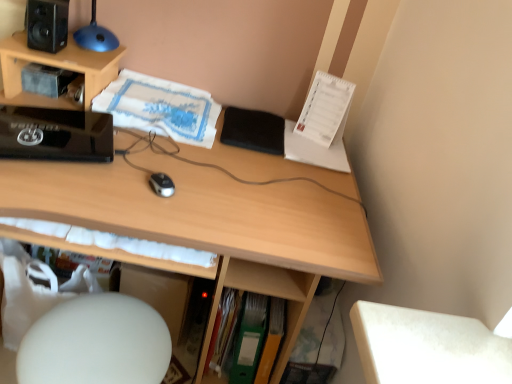
What do you see at coordinates (253, 130) in the screenshot? The height and width of the screenshot is (384, 512). I see `black matte notepad at center` at bounding box center [253, 130].

Find the location of a particular element. The image size is (512, 384). green matte folder at lower center, the second paperback book in the left-to-right sequence is located at coordinates (271, 340).

In order to face green matte folder at lower center, the second paperback book in the left-to-right sequence, should I rotate leftwards or rightwards?

Rotate right and turn 2.032 degrees.

At what (x,y) coordinates should I click in order to perform the action: click on wooden desk at center. Please return your answer as a coordinate pair (x, y). Looking at the image, I should click on (209, 218).

At what (x,y) coordinates should I click in order to perform the action: click on white paper at center, the first book in the top-to-bottom sequence. Please return your answer as a coordinate pair (x, y). Image resolution: width=512 pixels, height=384 pixels. Looking at the image, I should click on (160, 108).

Measure the distance between glossy black computer at left and camera.

glossy black computer at left is 3.36 feet away from camera.

This screenshot has width=512, height=384. What do you see at coordinates (249, 339) in the screenshot?
I see `green matte folder at lower center, which appears as the 2th paperback book when viewed from the right` at bounding box center [249, 339].

Locate an element on the screen. This screenshot has width=512, height=384. black matte notepad at center is located at coordinates (253, 130).

Considering the positions of objects black matte speaker at upper left and black plastic mouse at center in the image provided, who is behind, black matte speaker at upper left or black plastic mouse at center?

black matte speaker at upper left.

From the image's perspective, is black matte speaker at upper left below black plastic mouse at center?

No, from the image's perspective, black matte speaker at upper left is not below black plastic mouse at center.

Considering the relative sizes of black matte speaker at upper left and black plastic mouse at center in the image provided, is black matte speaker at upper left wider than black plastic mouse at center?

Indeed, black matte speaker at upper left has a greater width compared to black plastic mouse at center.

Where is `mouse that appears below the black matte speaker at upper left (from the image's perspective)`? The image size is (512, 384). mouse that appears below the black matte speaker at upper left (from the image's perspective) is located at coordinates (162, 184).

Would you consider glossy black computer at left to be distant from green matte folder at lower center, marked as the first paperback book in a left-to-right arrangement?

No, glossy black computer at left is not far from green matte folder at lower center, marked as the first paperback book in a left-to-right arrangement.

Between glossy black computer at left and green matte folder at lower center, marked as the first paperback book in a left-to-right arrangement, which one is positioned behind?

Positioned behind is green matte folder at lower center, marked as the first paperback book in a left-to-right arrangement.

Is glossy black computer at left positioned beyond the bounds of green matte folder at lower center, marked as the first paperback book in a left-to-right arrangement?

Yes, glossy black computer at left is located beyond the bounds of green matte folder at lower center, marked as the first paperback book in a left-to-right arrangement.

Does glossy black computer at left turn towards green matte folder at lower center, marked as the first paperback book in a left-to-right arrangement?

No, glossy black computer at left is not facing towards green matte folder at lower center, marked as the first paperback book in a left-to-right arrangement.

From a real-world perspective, does green matte folder at lower center, the first book viewed from the right, stand above green matte folder at lower center, which is counted as the first paperback book, starting from the right?

Correct, in the physical world, green matte folder at lower center, the first book viewed from the right, is higher than green matte folder at lower center, which is counted as the first paperback book, starting from the right.

Is green matte folder at lower center, the first book viewed from the right, taller than green matte folder at lower center, the second paperback book in the left-to-right sequence?

Yes, green matte folder at lower center, the first book viewed from the right, is taller than green matte folder at lower center, the second paperback book in the left-to-right sequence.

Is green matte folder at lower center, the first book positioned from the bottom, turned away from green matte folder at lower center, which is counted as the first paperback book, starting from the right?

No, green matte folder at lower center, which is counted as the first paperback book, starting from the right, is not at the back of green matte folder at lower center, the first book positioned from the bottom.

In the scene shown: Is green matte folder at lower center, the first book viewed from the right, to the right of green matte folder at lower center, which is counted as the first paperback book, starting from the right, from the viewer's perspective?

Incorrect, green matte folder at lower center, the first book viewed from the right, is not on the right side of green matte folder at lower center, which is counted as the first paperback book, starting from the right.

Consider the image. Between white paper at center, the 2th book positioned from the bottom, and green matte folder at lower center, marked as the first paperback book in a left-to-right arrangement, which one has smaller width?

Thinner between the two is green matte folder at lower center, marked as the first paperback book in a left-to-right arrangement.

From the image's perspective, which is above, white paper at center, the first book in the top-to-bottom sequence, or green matte folder at lower center, marked as the first paperback book in a left-to-right arrangement?

From the image's view, white paper at center, the first book in the top-to-bottom sequence, is above.

Is point (202, 109) in front of point (246, 314)?

No, (202, 109) is behind (246, 314).

Which is more to the right, white paper at center, the first book in the top-to-bottom sequence, or green matte folder at lower center, which appears as the 2th paperback book when viewed from the right?

green matte folder at lower center, which appears as the 2th paperback book when viewed from the right, is more to the right.

Does black plastic mouse at center appear on the right side of green matte folder at lower center, the second book viewed from the left?

In fact, black plastic mouse at center is to the left of green matte folder at lower center, the second book viewed from the left.

From the image's perspective, which is below, black plastic mouse at center or green matte folder at lower center, the 2th book when ordered from top to bottom?

green matte folder at lower center, the 2th book when ordered from top to bottom, appears lower in the image.

Is point (170, 179) positioned in front of point (228, 325)?

Yes.

From the image's perspective, which one is positioned lower, glossy black computer at left or green matte folder at lower center, the first book viewed from the right?

green matte folder at lower center, the first book viewed from the right, is shown below in the image.

Is glossy black computer at left spatially inside green matte folder at lower center, the second book viewed from the left, or outside of it?

glossy black computer at left is spatially situated outside green matte folder at lower center, the second book viewed from the left.

Who is taller, glossy black computer at left or green matte folder at lower center, the 2th book when ordered from top to bottom?

green matte folder at lower center, the 2th book when ordered from top to bottom, is taller.

Which point is more forward, (45, 122) or (231, 318)?

The point (45, 122) is closer.

From the picture: From the image's perspective, which one is positioned higher, white matte computer chair at lower left or green matte folder at lower center, marked as the first paperback book in a left-to-right arrangement?

green matte folder at lower center, marked as the first paperback book in a left-to-right arrangement, is shown above in the image.

Where is `paperback book that is the 2nd object located above the white matte computer chair at lower left (from the image's perspective)`? paperback book that is the 2nd object located above the white matte computer chair at lower left (from the image's perspective) is located at coordinates (249, 339).

Considering the sizes of objects white matte computer chair at lower left and green matte folder at lower center, which appears as the 2th paperback book when viewed from the right, in the image provided, who is thinner, white matte computer chair at lower left or green matte folder at lower center, which appears as the 2th paperback book when viewed from the right,?

Thinner between the two is green matte folder at lower center, which appears as the 2th paperback book when viewed from the right.

From a real-world perspective, which object rests below the other?

From a 3D spatial view, green matte folder at lower center, which appears as the 2th paperback book when viewed from the right, is below.

This screenshot has height=384, width=512. What are the coordinates of `speaker located on the left of black plastic mouse at center` in the screenshot? It's located at (47, 24).

From the glossy black computer at left, count 2nd paperback books backward and point to it. Please provide its 2D coordinates.

[(249, 339)]

When comparing their distances from green matte folder at lower center, which appears as the 2th paperback book when viewed from the right, does white matte computer chair at lower left or black plastic mouse at center seem closer?

white matte computer chair at lower left is positioned closer to the anchor green matte folder at lower center, which appears as the 2th paperback book when viewed from the right.

Based on their spatial positions, is green matte folder at lower center, marked as the first paperback book in a left-to-right arrangement, or white paper at center, the 2th book positioned from the bottom, closer to white matte computer chair at lower left?

green matte folder at lower center, marked as the first paperback book in a left-to-right arrangement.

From the image, which object appears to be nearer to black plastic mouse at center, white matte computer chair at lower left or white paper at center, the 2th book positioned from the bottom?

white matte computer chair at lower left lies closer to black plastic mouse at center than the other object.

From the image, which object appears to be farther from green matte folder at lower center, which is counted as the first paperback book, starting from the right, black plastic mouse at center or white paper at center, which ranks as the 1th book in left-to-right order?

white paper at center, which ranks as the 1th book in left-to-right order, lies further to green matte folder at lower center, which is counted as the first paperback book, starting from the right, than the other object.

When comparing their distances from white matte computer chair at lower left, does black matte notepad at center or green matte folder at lower center, which is counted as the first paperback book, starting from the right, seem further?

black matte notepad at center is positioned further to the anchor white matte computer chair at lower left.

Considering their positions, is green matte folder at lower center, marked as the first paperback book in a left-to-right arrangement, positioned further to white matte computer chair at lower left than green matte folder at lower center, the second paperback book in the left-to-right sequence?

green matte folder at lower center, the second paperback book in the left-to-right sequence, lies further to white matte computer chair at lower left than the other object.

When comparing their distances from green matte folder at lower center, the first book viewed from the right, does wooden desk at center or white paper at center, marked as the 2th book in a right-to-left arrangement, seem further?

white paper at center, marked as the 2th book in a right-to-left arrangement, is positioned further to the anchor green matte folder at lower center, the first book viewed from the right.

Based on the photo, based on their spatial positions, is green matte folder at lower center, the first book viewed from the right, or white paper at center, the first book in the top-to-bottom sequence, closer to green matte folder at lower center, which is counted as the first paperback book, starting from the right?

The object closer to green matte folder at lower center, which is counted as the first paperback book, starting from the right, is green matte folder at lower center, the first book viewed from the right.

Find the location of `book between black plastic mouse at center and white matte computer chair at lower left in the up-down direction`. book between black plastic mouse at center and white matte computer chair at lower left in the up-down direction is located at coordinates (224, 330).

This screenshot has height=384, width=512. Identify the location of desk between glossy black computer at left and green matte folder at lower center, the second paperback book in the left-to-right sequence, in the up-down direction. (209, 218).

Where is `mouse between black matte speaker at upper left and green matte folder at lower center, which is counted as the first paperback book, starting from the right, from top to bottom`? Image resolution: width=512 pixels, height=384 pixels. mouse between black matte speaker at upper left and green matte folder at lower center, which is counted as the first paperback book, starting from the right, from top to bottom is located at coordinates (162, 184).

Where is `mouse between glossy black computer at left and white matte computer chair at lower left in the vertical direction`? The width and height of the screenshot is (512, 384). mouse between glossy black computer at left and white matte computer chair at lower left in the vertical direction is located at coordinates (162, 184).